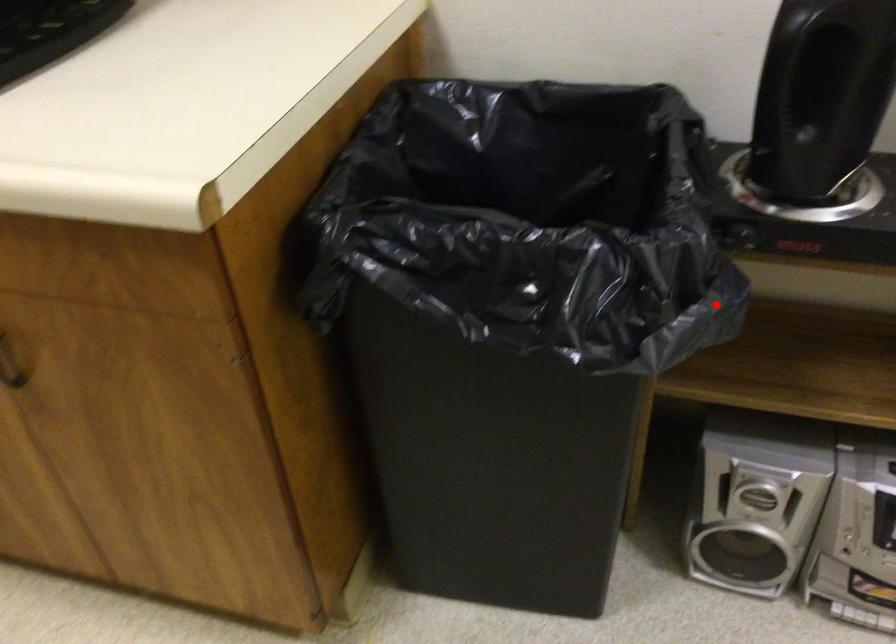
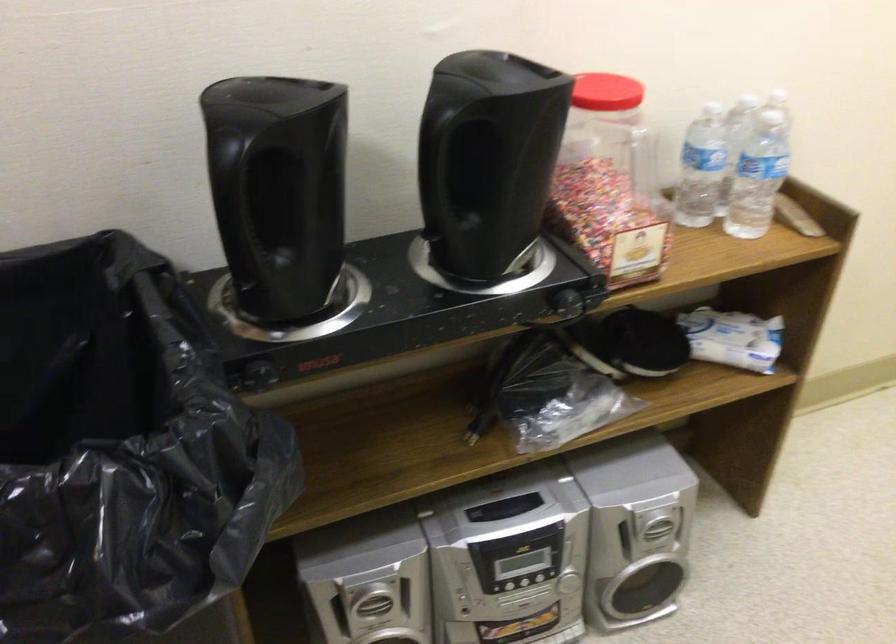
Find the pixel in the second image that matches the highlighted location in the first image.

(274, 480)